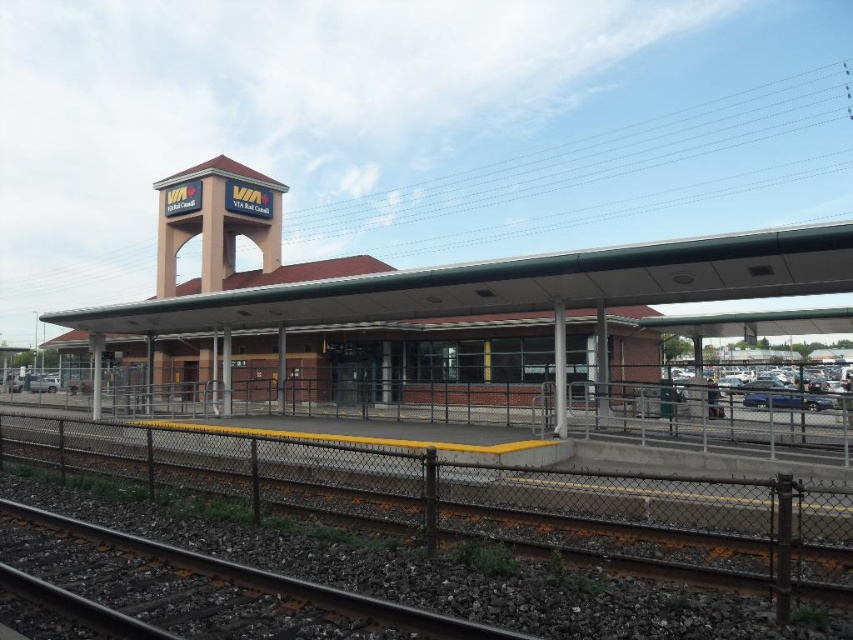
Question: In this image, where is metallic track at lower left located relative to black metal train track at lower left?

Choices:
 (A) above
 (B) below

Answer: (B)

Question: Which object appears closest to the camera in this image?

Choices:
 (A) black metal train track at lower left
 (B) metallic track at lower left

Answer: (A)

Question: Which point is closer to the camera?

Choices:
 (A) (102, 465)
 (B) (439, 625)

Answer: (B)

Question: Can you confirm if metallic track at lower left is thinner than black metal train track at lower left?

Choices:
 (A) no
 (B) yes

Answer: (A)

Question: Is metallic track at lower left positioned behind black metal train track at lower left?

Choices:
 (A) no
 (B) yes

Answer: (B)